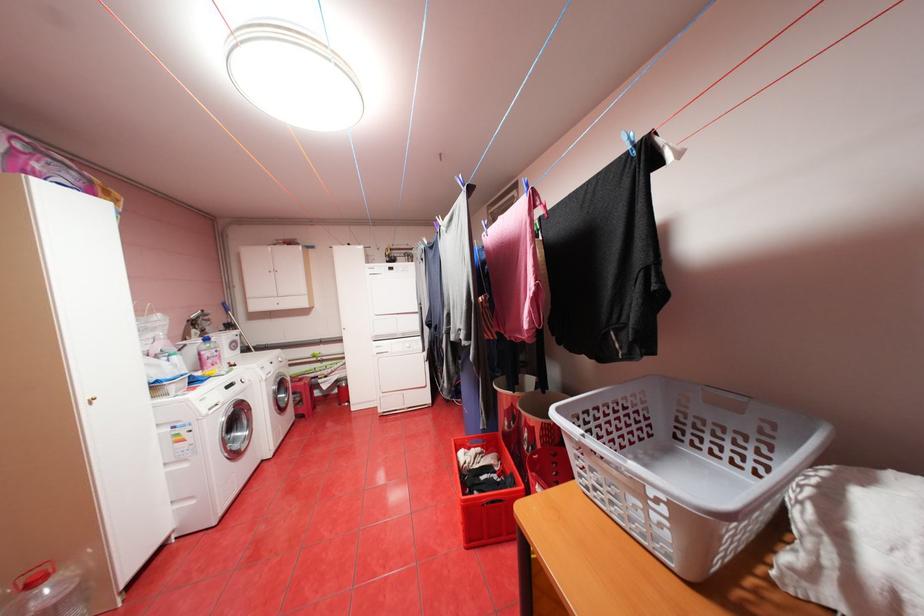
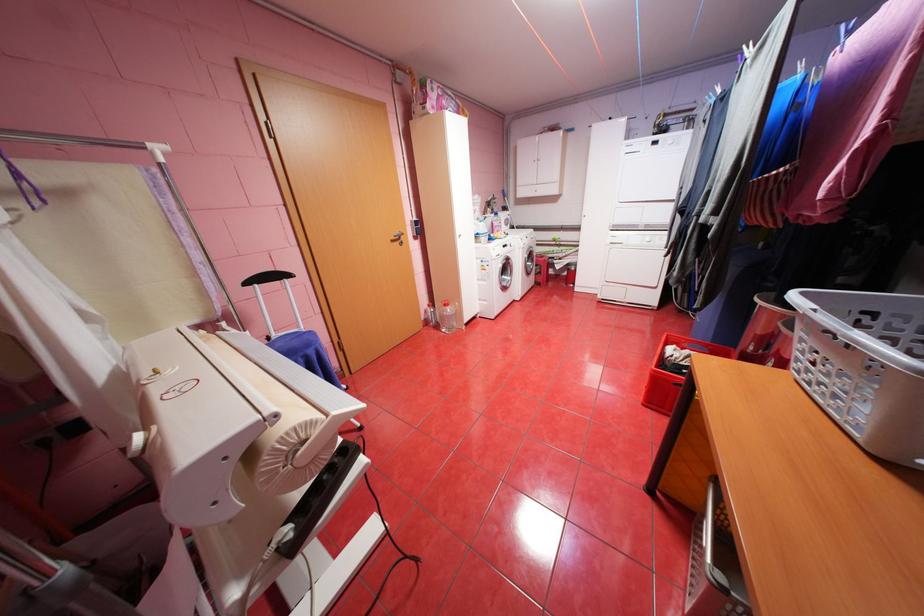
Locate, in the second image, the point that corresponds to point 566,411 in the first image.

(811, 293)